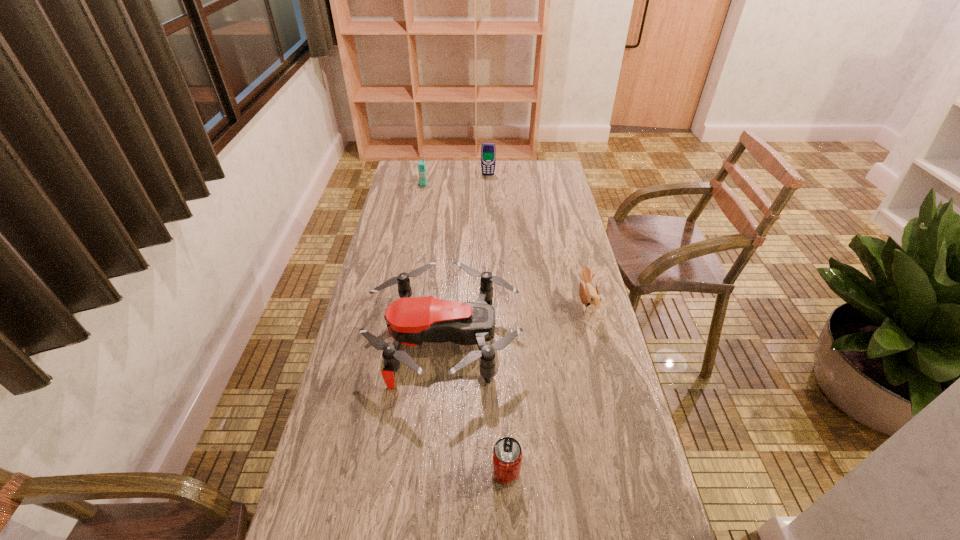
Locate an element on the screen. The image size is (960, 540). the farthest object is located at coordinates (488, 150).

You are a GUI agent. You are given a task and a screenshot of the screen. Output one action in this format:
    pyautogui.click(x=<x>, y=<y>)
    Task: Click on the right cellular telephone
    Image resolution: width=960 pixels, height=540 pixels.
    Given the screenshot: What is the action you would take?
    488,150

Locate an element on the screen. This screenshot has height=540, width=960. the nearer cellular telephone is located at coordinates (421, 164).

Find the location of a particular element. The width and height of the screenshot is (960, 540). the fourth nearest object is located at coordinates (421, 164).

Locate an element on the screen. The width and height of the screenshot is (960, 540). drone is located at coordinates (410, 321).

You are a GUI agent. You are given a task and a screenshot of the screen. Output one action in this format:
    pyautogui.click(x=<x>, y=<y>)
    Task: Click on the pop soda
    This screenshot has height=540, width=960.
    Given the screenshot: What is the action you would take?
    pyautogui.click(x=507, y=454)

Locate an element on the screen. the rightmost object is located at coordinates pyautogui.click(x=590, y=297).

In order to click on free space located on the front-facing side of the farthest object in this screenshot , I will do `click(489, 210)`.

Image resolution: width=960 pixels, height=540 pixels. In order to click on vacant region located 0.260m on the keypad of the nearer cellular telephone in this screenshot , I will do `click(417, 218)`.

Locate an element on the screen. free region located on the camera side of the drone is located at coordinates (604, 339).